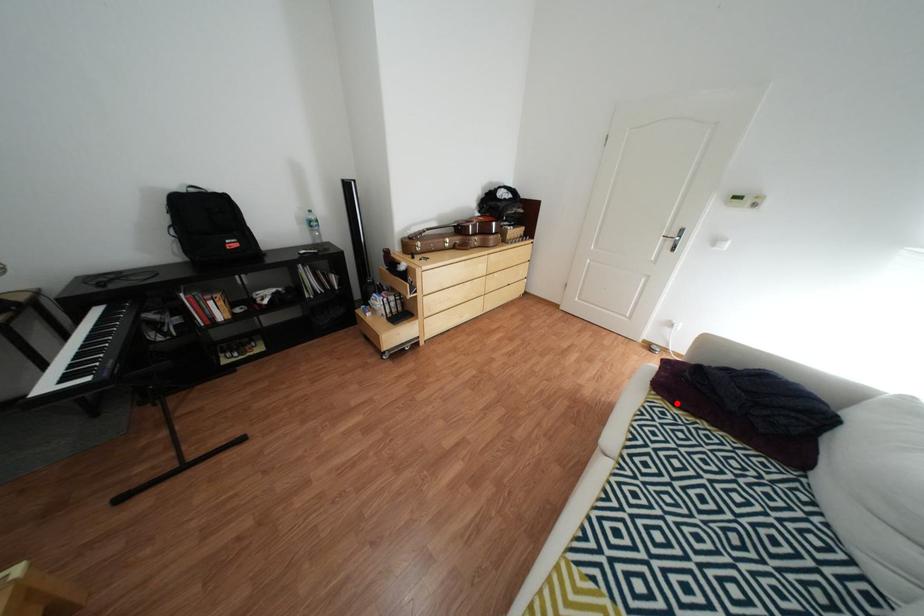
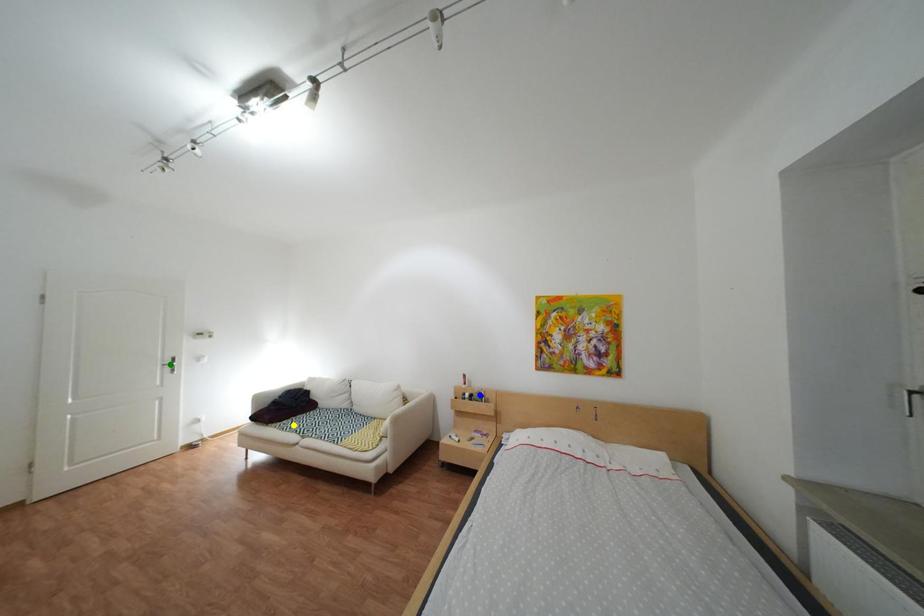
Question: I am providing you with two images of the same scene from different viewpoints. A red point is marked on the first image. You are given multiple points on the second image. Which mark in image 2 goes with the point in image 1?

Choices:
 (A) blue point
 (B) green point
 (C) yellow point

Answer: (C)